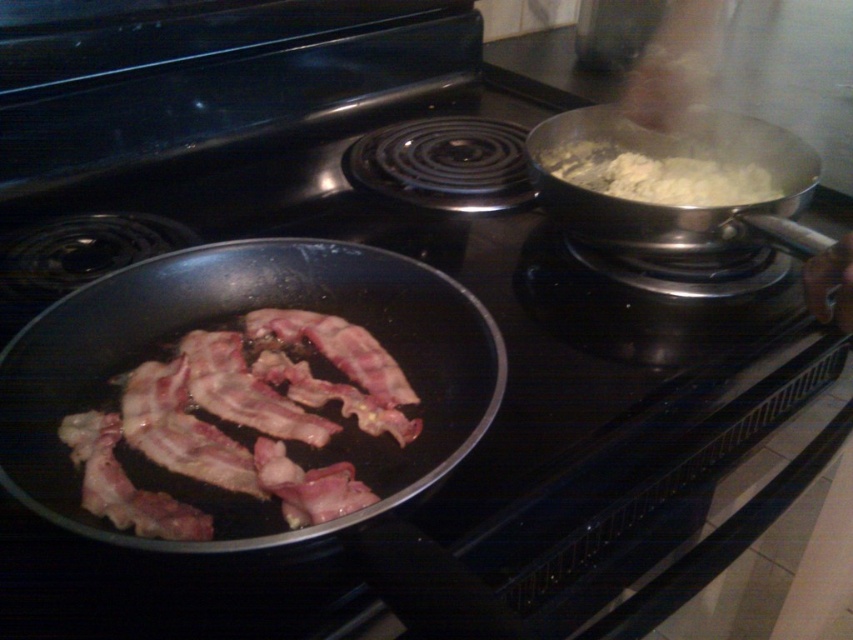
You are standing in front of a stovetop with two pans. The left pan has partially cooked bacon, and the right pan has steaming mashed potatoes. You want to reach a point that is exactly 27.21 inches away from you. Can you tell me if the point at coordinates point (x=198, y=275) is within reach of your arm, assuming your arm can extend 30 inches?

The distance of point (x=198, y=275) from viewer is 27.21 inches, so yes, the point at coordinates point (x=198, y=275) is within reach of your arm since it is closer than the 30 inches extension.

In the scene shown: You are a chef preparing a dish and need to determine which item is larger between the white matte pan at upper right and the white fluffy food at upper right. Based on the scene, which one is larger?

The white matte pan at upper right is bigger than the white fluffy food at upper right according to the description.